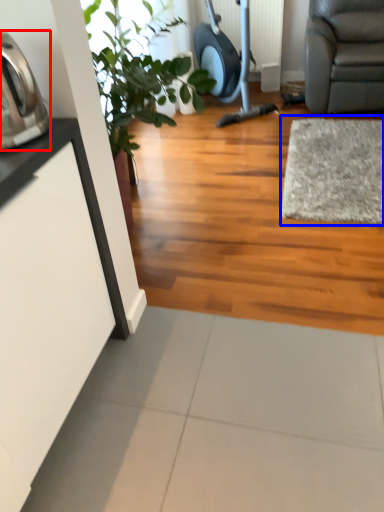
Question: Among these objects, which one is nearest to the camera, appliance (highlighted by a red box) or mat (highlighted by a blue box)?

Choices:
 (A) appliance
 (B) mat

Answer: (A)